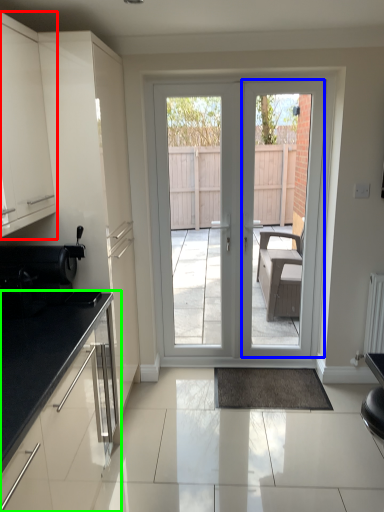
Question: Estimate the real-world distances between objects in this image. Which object is farther from cabinetry (highlighted by a red box), screen door (highlighted by a blue box) or cabinetry (highlighted by a green box)?

Choices:
 (A) screen door
 (B) cabinetry

Answer: (A)